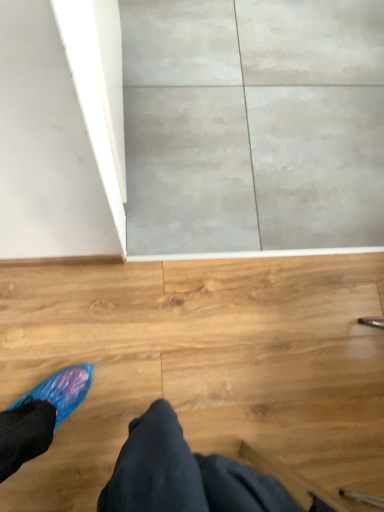
Question: Is point 165,490 closer or farther from the camera than point 185,198?

Choices:
 (A) closer
 (B) farther

Answer: (A)

Question: Relative to gray concrete wall at upper center, is blue plastic shoe at lower left in front or behind?

Choices:
 (A) front
 (B) behind

Answer: (A)

Question: Is blue plastic shoe at lower left taller or shorter than gray concrete wall at upper center?

Choices:
 (A) tall
 (B) short

Answer: (A)

Question: From a real-world perspective, is gray concrete wall at upper center positioned above or below blue plastic shoe at lower left?

Choices:
 (A) below
 (B) above

Answer: (A)

Question: Is gray concrete wall at upper center in front of or behind blue plastic shoe at lower left in the image?

Choices:
 (A) behind
 (B) front

Answer: (A)

Question: From their relative heights in the image, would you say gray concrete wall at upper center is taller or shorter than blue plastic shoe at lower left?

Choices:
 (A) tall
 (B) short

Answer: (B)

Question: Is gray concrete wall at upper center bigger or smaller than blue plastic shoe at lower left?

Choices:
 (A) small
 (B) big

Answer: (A)